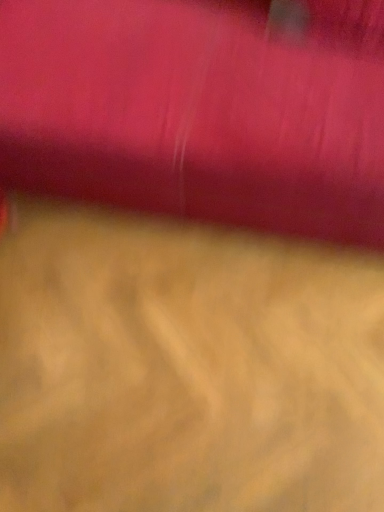
Question: From their relative heights in the image, would you say wooden floor at center is taller or shorter than matte pink curtain at upper center?

Choices:
 (A) short
 (B) tall

Answer: (A)

Question: Based on their sizes in the image, would you say wooden floor at center is bigger or smaller than matte pink curtain at upper center?

Choices:
 (A) small
 (B) big

Answer: (A)

Question: Based on their positions, is wooden floor at center located to the left or right of matte pink curtain at upper center?

Choices:
 (A) right
 (B) left

Answer: (B)

Question: Visually, is matte pink curtain at upper center positioned to the left or to the right of wooden floor at center?

Choices:
 (A) left
 (B) right

Answer: (B)

Question: Is matte pink curtain at upper center in front of or behind wooden floor at center in the image?

Choices:
 (A) front
 (B) behind

Answer: (A)

Question: Is matte pink curtain at upper center inside the boundaries of wooden floor at center, or outside?

Choices:
 (A) inside
 (B) outside

Answer: (B)

Question: Is matte pink curtain at upper center taller or shorter than wooden floor at center?

Choices:
 (A) tall
 (B) short

Answer: (A)